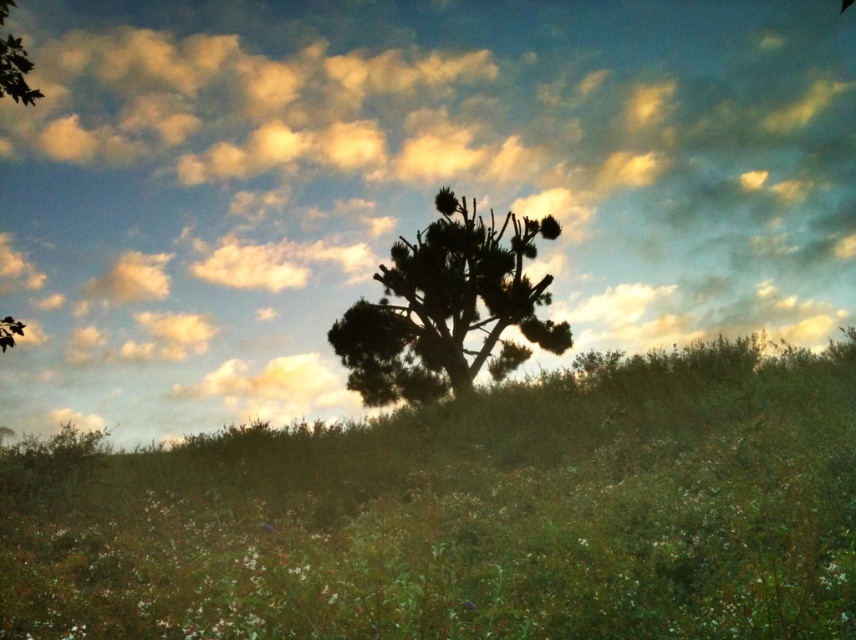
Does green grassy hillside at center have a larger size compared to silhouette/branchy tree at center?

Yes.

Is green grassy hillside at center further to the viewer compared to silhouette/branchy tree at center?

No, it is not.

The height and width of the screenshot is (640, 856). Find the location of `green grassy hillside at center`. green grassy hillside at center is located at coordinates (465, 515).

Does cloudy sky at upper center appear on the left side of silhouette/branchy tree at center?

Incorrect, cloudy sky at upper center is not on the left side of silhouette/branchy tree at center.

Can you confirm if cloudy sky at upper center is bigger than silhouette/branchy tree at center?

Indeed, cloudy sky at upper center has a larger size compared to silhouette/branchy tree at center.

Locate an element on the screen. The width and height of the screenshot is (856, 640). cloudy sky at upper center is located at coordinates 402,182.

Does cloudy sky at upper center have a greater height compared to green grassy hillside at center?

Indeed, cloudy sky at upper center has a greater height compared to green grassy hillside at center.

Does cloudy sky at upper center appear on the right side of green grassy hillside at center?

Yes, cloudy sky at upper center is to the right of green grassy hillside at center.

The image size is (856, 640). Find the location of `cloudy sky at upper center`. cloudy sky at upper center is located at coordinates (402, 182).